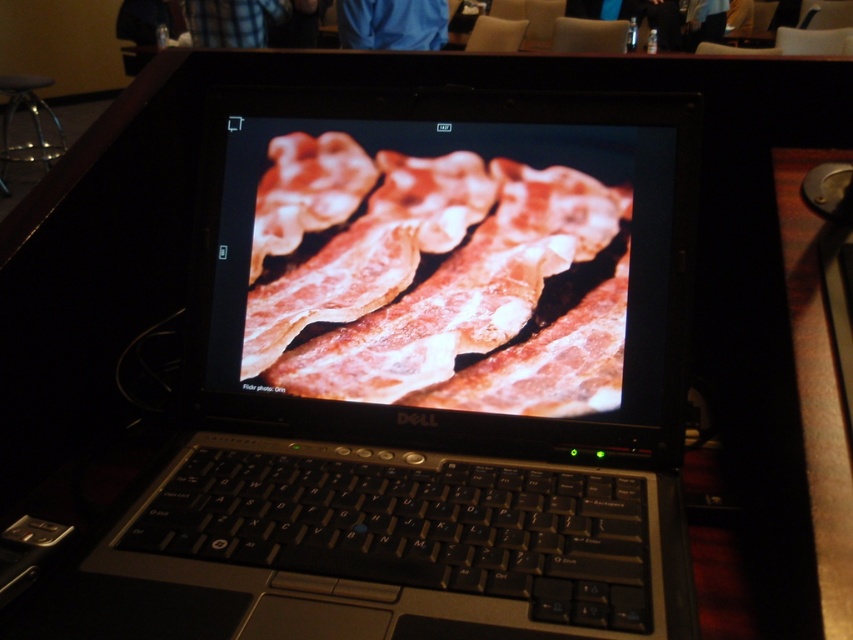
Question: Does satin black laptop at center have a greater width compared to slightly crispy bacon at center?

Choices:
 (A) yes
 (B) no

Answer: (A)

Question: Which of the following is the farthest from the observer?

Choices:
 (A) (552, 179)
 (B) (427, 301)

Answer: (B)

Question: Does satin black laptop at center have a larger size compared to slightly crispy bacon at center?

Choices:
 (A) yes
 (B) no

Answer: (A)

Question: Does satin black laptop at center appear over slightly crispy bacon at center?

Choices:
 (A) yes
 (B) no

Answer: (B)